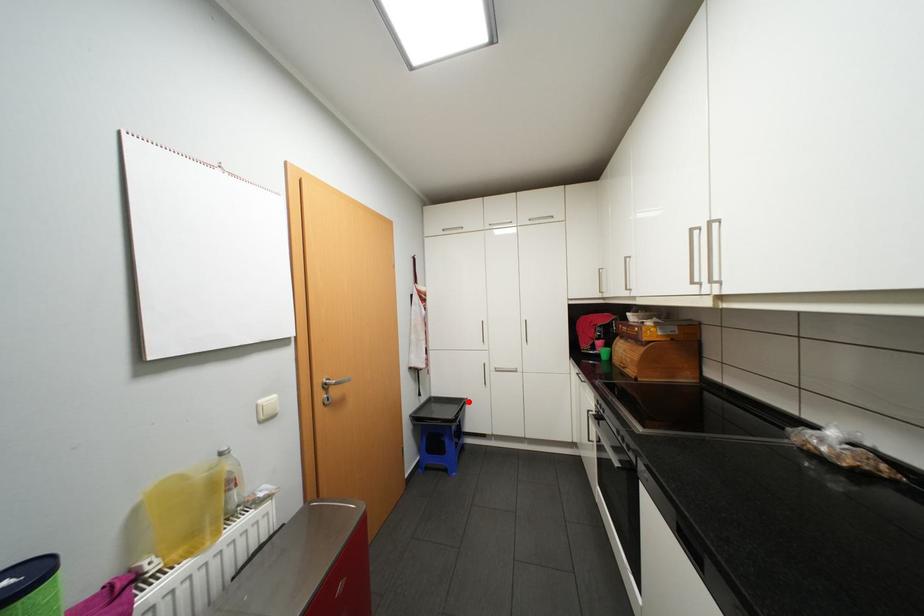
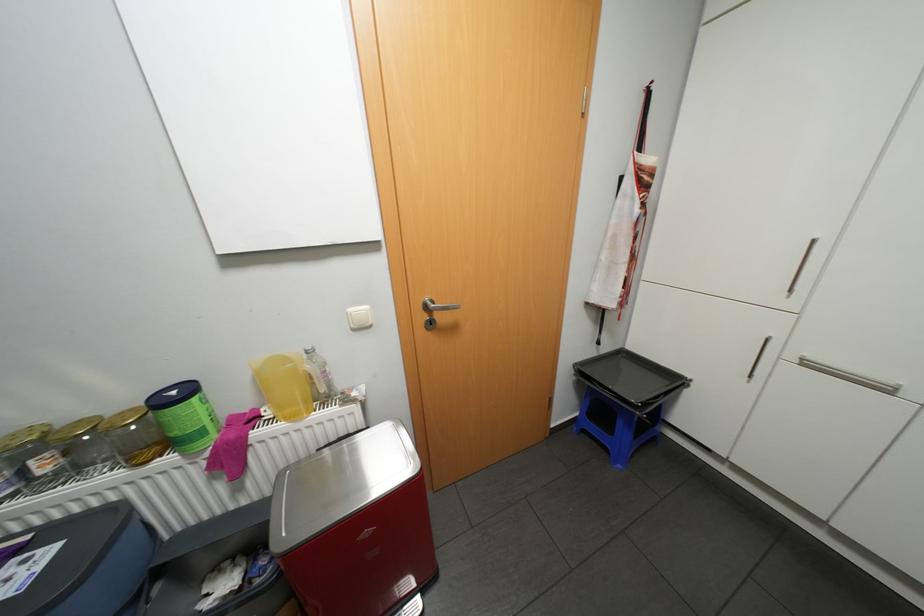
In the second image, find the point that corresponds to the highlighted location in the first image.

(684, 379)